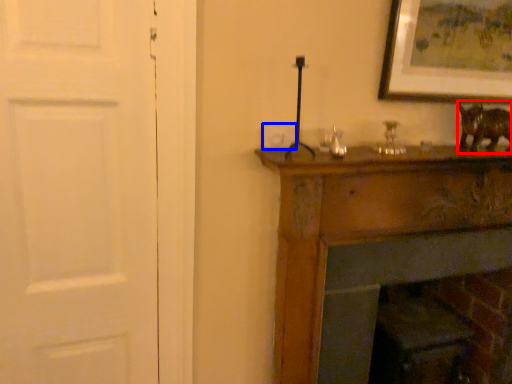
Question: Which point is closer to the camera, animal (highlighted by a red box) or light switch (highlighted by a blue box)?

Choices:
 (A) animal
 (B) light switch

Answer: (B)